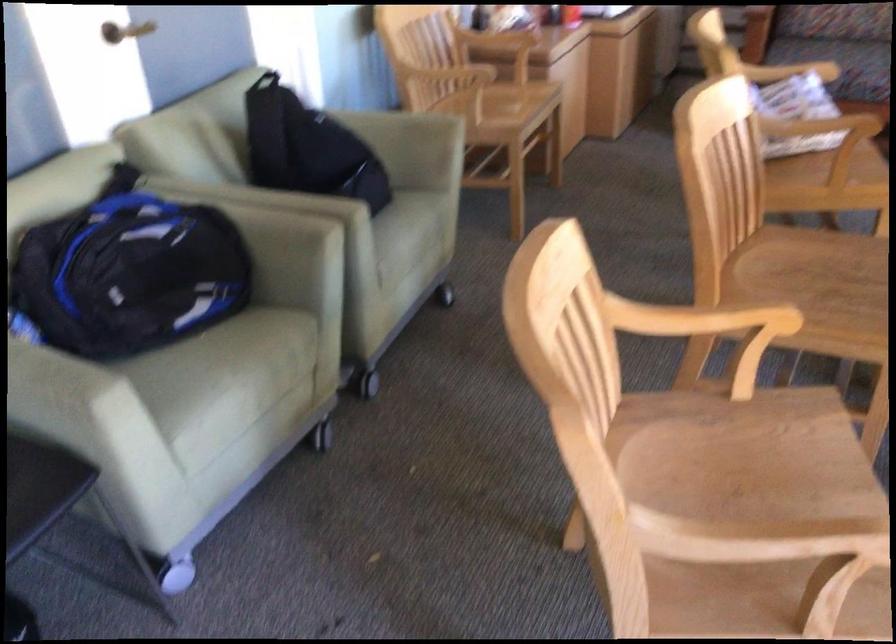
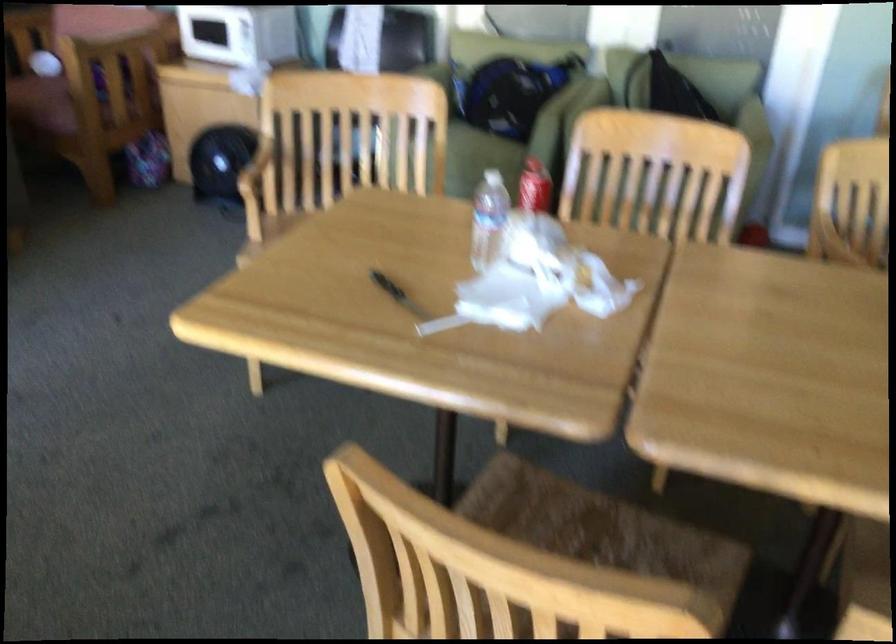
Question: I am providing you with two images of the same scene from different viewpoints. Which of the following objects are not visible in image2?

Choices:
 (A) black handle knife
 (B) orange valve handle
 (C) red soda bottle
 (D) chair armrest

Answer: (D)